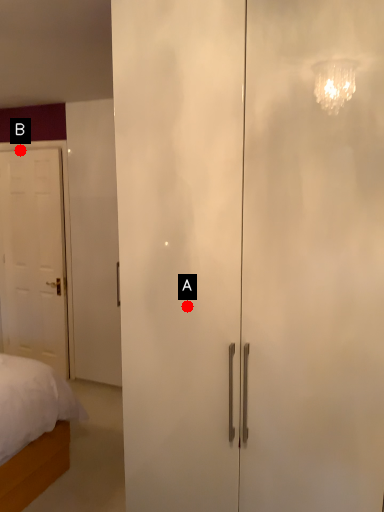
Question: Two points are circled on the image, labeled by A and B beside each circle. Which of the following is the farthest from the observer?

Choices:
 (A) A is further
 (B) B is further

Answer: (B)